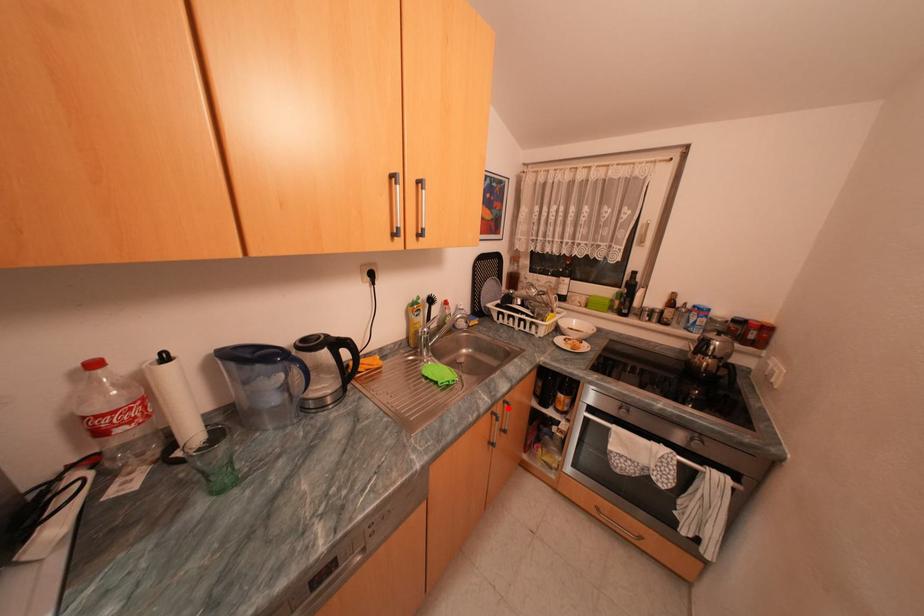
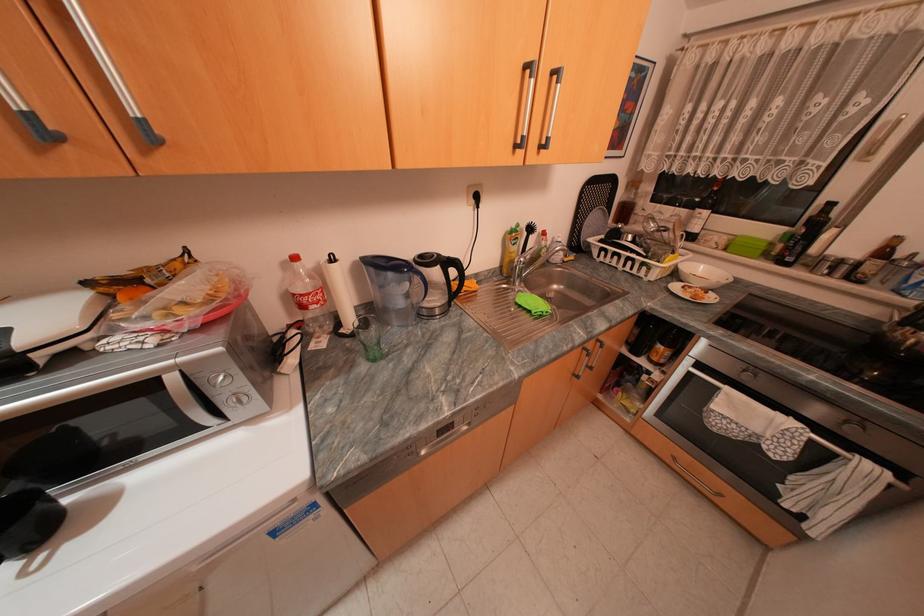
The point at the highlighted location is marked in the first image. Where is the corresponding point in the second image?

(599, 345)